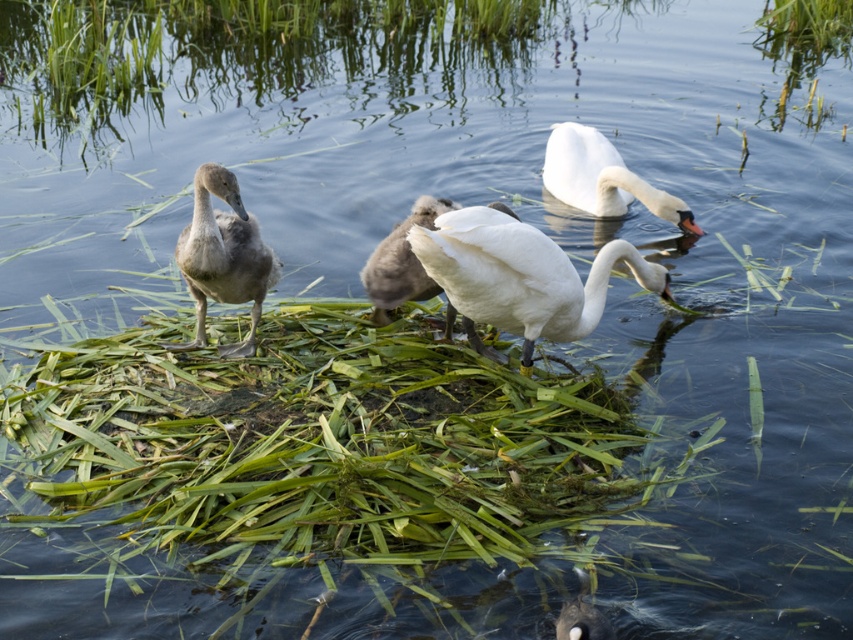
What do you see at coordinates (223, 257) in the screenshot?
I see `gray downy duckling at left` at bounding box center [223, 257].

Is gray downy duckling at left closer to the viewer compared to white glossy swan at upper center?

Yes, it is in front of white glossy swan at upper center.

The image size is (853, 640). What do you see at coordinates (223, 257) in the screenshot?
I see `gray downy duckling at left` at bounding box center [223, 257].

At what (x,y) coordinates should I click in order to perform the action: click on gray downy duckling at left. Please return your answer as a coordinate pair (x, y). Looking at the image, I should click on (223, 257).

Is white glossy swan at center positioned in front of white matte swan at center?

Yes, it is in front of white matte swan at center.

Between white glossy swan at center and white matte swan at center, which one is positioned lower?

white glossy swan at center

Between point (482, 316) and point (437, 198), which one is positioned behind?

Positioned behind is point (437, 198).

At what (x,y) coordinates should I click in order to perform the action: click on white glossy swan at center. Please return your answer as a coordinate pair (x, y). Looking at the image, I should click on (520, 276).

Does white glossy swan at upper center have a greater height compared to white matte swan at center?

Yes.

Measure the distance between point (595, 198) and camera.

Point (595, 198) and camera are 6.64 meters apart from each other.

The height and width of the screenshot is (640, 853). What are the coordinates of `white glossy swan at upper center` in the screenshot? It's located at (602, 177).